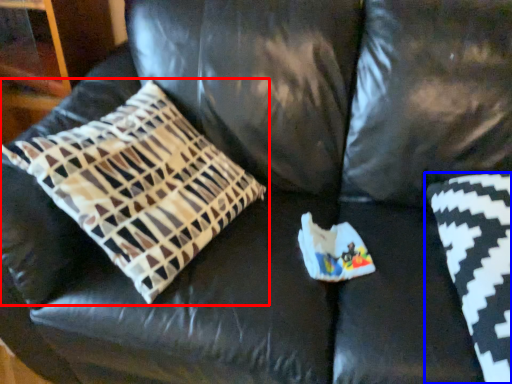
Question: Which object appears closest to the camera in this image, pillow (highlighted by a red box) or pillow (highlighted by a blue box)?

Choices:
 (A) pillow
 (B) pillow

Answer: (A)